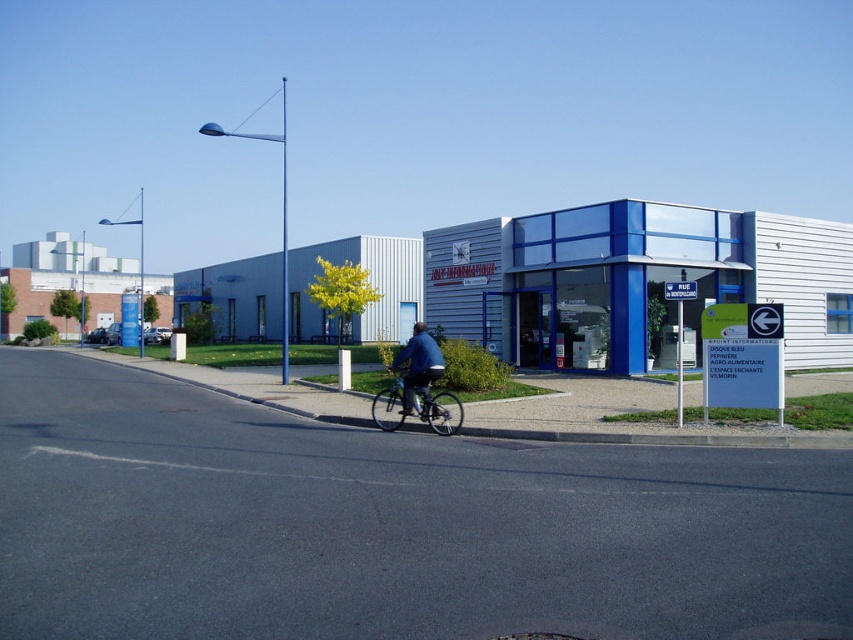
You are a delivery person trying to reach the entrance of the JOLY INFORMATIQUE building. You see a metallic silver bicycle at center and a blue denim jacket at center. Which object is closer to the entrance?

The metallic silver bicycle at center is closer to the entrance because it is positioned below the blue denim jacket at center, indicating it is lower and thus nearer in the scene.

You are a delivery person who needs to load both the metallic silver bicycle at center and the blue denim jacket at center into a van. The van has a height limit of 1.5 meters. Based on the scene, will both items fit vertically inside the van?

The metallic silver bicycle at center is shorter than the blue denim jacket at center. Since the blue denim jacket at center is taller than the bicycle, but we don not know the exact height of the jacket, we cannot confirm if both items will fit within the van

You are standing on the sidewalk in front of the JOLY INFORMATIQUE building and see the metallic silver bicycle at center. If you want to reach the bicycle quickly, how many steps do you estimate you would need to take?

The metallic silver bicycle at center is 13.90 meters away from viewer. Assuming an average step length of about 0.76 meters, you would need approximately 18 steps to reach the metallic silver bicycle at center.